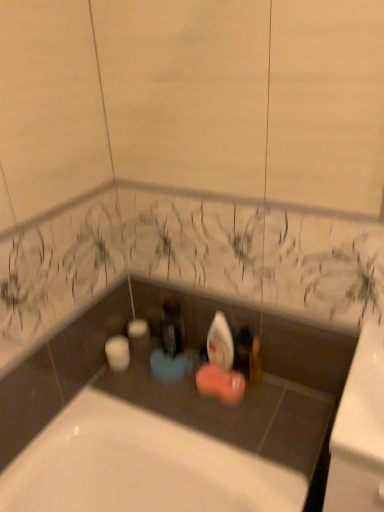
You are a GUI agent. You are given a task and a screenshot of the screen. Output one action in this format:
    pyautogui.click(x=<x>, y=<y>)
    Task: Click on the matte gold soap at center
    This screenshot has width=384, height=512.
    Given the screenshot: What is the action you would take?
    pyautogui.click(x=255, y=362)

This screenshot has width=384, height=512. What do you see at coordinates (255, 362) in the screenshot?
I see `matte gold soap at center` at bounding box center [255, 362].

Measure the distance between point (253,365) and camera.

The distance of point (253,365) from camera is 4.50 feet.

This screenshot has width=384, height=512. Find the location of `matte black bottle at center`. matte black bottle at center is located at coordinates (172, 328).

The height and width of the screenshot is (512, 384). Describe the element at coordinates (172, 328) in the screenshot. I see `matte black bottle at center` at that location.

Find the location of `matte gold soap at center`. matte gold soap at center is located at coordinates (255, 362).

Is matte gold soap at center to the right of matte black bottle at center from the viewer's perspective?

Indeed, matte gold soap at center is positioned on the right side of matte black bottle at center.

Based on the photo, is matte gold soap at center further to the viewer compared to matte black bottle at center?

No, matte gold soap at center is closer to the viewer.

Does point (257, 342) appear closer or farther from the camera than point (182, 318)?

Point (257, 342).

From the picture: From the image's perspective, who appears lower, matte gold soap at center or matte black bottle at center?

matte gold soap at center, from the image's perspective.

From a real-world perspective, which is physically below, matte gold soap at center or matte black bottle at center?

In real-world perspective, matte gold soap at center is lower.

Is matte gold soap at center wider or thinner than matte black bottle at center?

Considering their sizes, matte gold soap at center looks broader than matte black bottle at center.

Considering the sizes of objects matte gold soap at center and matte black bottle at center in the image provided, who is shorter, matte gold soap at center or matte black bottle at center?

matte black bottle at center is shorter.

Considering the sizes of objects matte gold soap at center and matte black bottle at center in the image provided, who is smaller, matte gold soap at center or matte black bottle at center?

matte gold soap at center is smaller.

Is matte gold soap at center situated inside matte black bottle at center or outside?

matte gold soap at center is not inside matte black bottle at center, it's outside.

Does matte gold soap at center touch matte black bottle at center?

No, matte gold soap at center is not in contact with matte black bottle at center.

Does matte gold soap at center turn towards matte black bottle at center?

No, matte gold soap at center is not aimed at matte black bottle at center.

How much distance is there between matte gold soap at center and matte black bottle at center?

matte gold soap at center is 10.75 inches away from matte black bottle at center.

Identify the location of toiletry on the right of matte black bottle at center. This screenshot has height=512, width=384. (255, 362).

Considering the positions of objects matte black bottle at center and matte gold soap at center in the image provided, who is more to the left, matte black bottle at center or matte gold soap at center?

From the viewer's perspective, matte black bottle at center appears more on the left side.

Between matte black bottle at center and matte gold soap at center, which one is positioned behind?

matte black bottle at center is more distant.

Considering the positions of points (171, 346) and (255, 382), is point (171, 346) closer to camera compared to point (255, 382)?

No, (171, 346) is behind (255, 382).

In the scene shown: From the image's perspective, is matte black bottle at center located above matte gold soap at center?

Yes, from the image's perspective, matte black bottle at center is on top of matte gold soap at center.

In the scene shown: From a real-world perspective, is matte black bottle at center located beneath matte gold soap at center?

Actually, matte black bottle at center is physically above matte gold soap at center in the real world.

Does matte black bottle at center have a greater width compared to matte gold soap at center?

In fact, matte black bottle at center might be narrower than matte gold soap at center.

Between matte black bottle at center and matte gold soap at center, which one has more height?

matte gold soap at center.

Who is bigger, matte black bottle at center or matte gold soap at center?

matte black bottle at center is bigger.

Choose the correct answer: Is matte black bottle at center inside matte gold soap at center or outside it?

matte black bottle at center is not enclosed by matte gold soap at center.

From the picture: Is matte black bottle at center beside matte gold soap at center?

No, matte black bottle at center is not touching matte gold soap at center.

Is matte black bottle at center turned away from matte gold soap at center?

No, matte black bottle at center is not facing away from matte gold soap at center.

Where is `toiletry beneath the matte black bottle at center (from a real-world perspective)`? Image resolution: width=384 pixels, height=512 pixels. toiletry beneath the matte black bottle at center (from a real-world perspective) is located at coordinates (255, 362).

Where is `toiletry lying below the matte black bottle at center (from the image's perspective)`? toiletry lying below the matte black bottle at center (from the image's perspective) is located at coordinates (255, 362).

At what (x,y) coordinates should I click in order to perform the action: click on bottle on the left of matte gold soap at center. Please return your answer as a coordinate pair (x, y). Looking at the image, I should click on (172, 328).